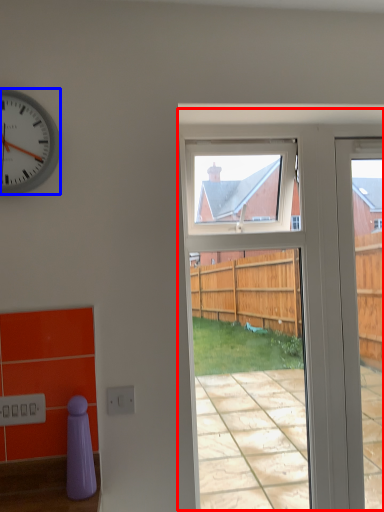
Question: Which object is closer to the camera taking this photo, screen door (highlighted by a red box) or clock (highlighted by a blue box)?

Choices:
 (A) screen door
 (B) clock

Answer: (B)